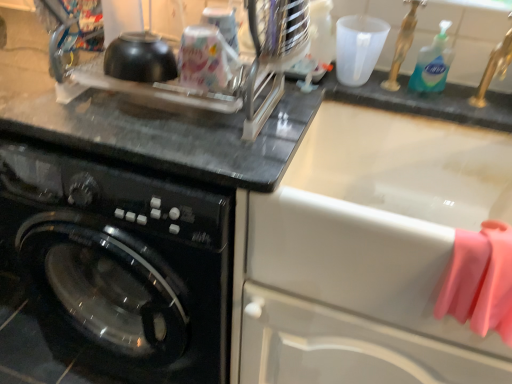
Locate an element on the screen. Image resolution: width=512 pixels, height=384 pixels. vacant space to the right of blue liquid soap at upper right is located at coordinates tap(478, 95).